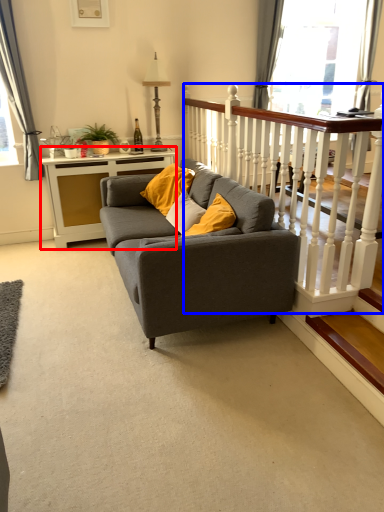
Question: Among these objects, which one is nearest to the camera, table (highlighted by a red box) or balustrade (highlighted by a blue box)?

Choices:
 (A) table
 (B) balustrade

Answer: (B)